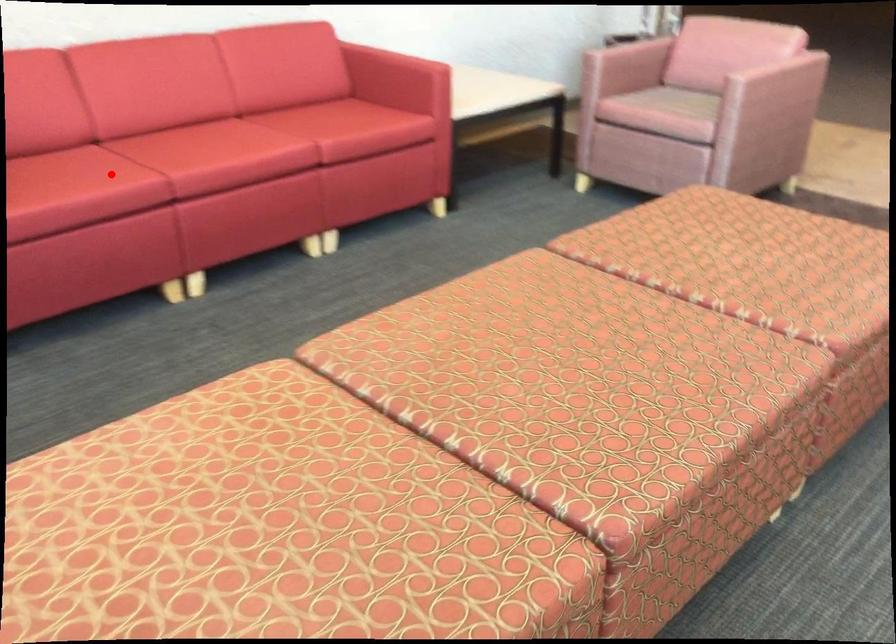
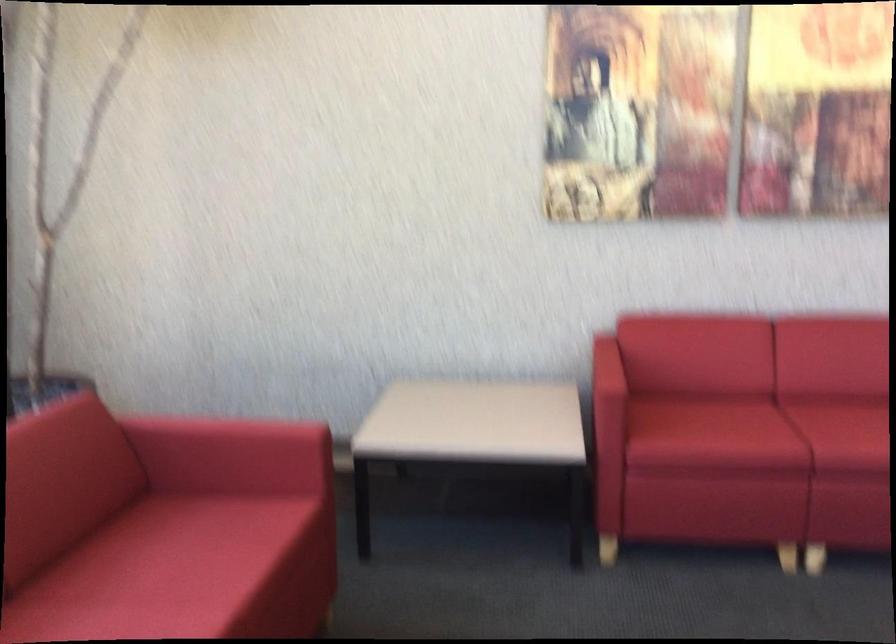
Where in the second image is the point corresponding to the highlighted location from the first image?

(757, 431)